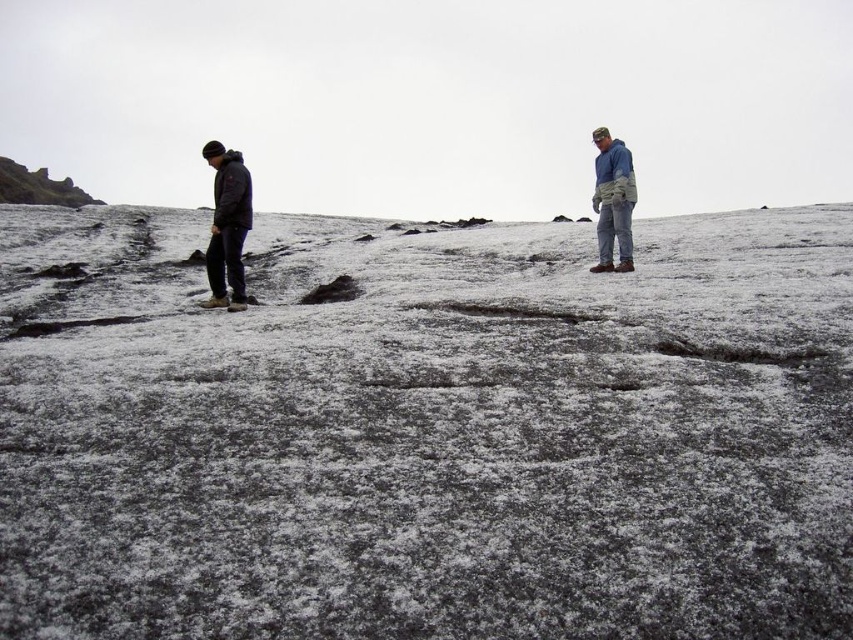
Question: Which point appears closest to the camera in this image?

Choices:
 (A) (79, 195)
 (B) (619, 195)
 (C) (517, 256)
 (D) (223, 147)

Answer: (D)

Question: Is blue fleece jacket at right to the left of rugged stone cliff at upper left from the viewer's perspective?

Choices:
 (A) no
 (B) yes

Answer: (A)

Question: Does white textured snow at center lie in front of matte black jacket at left?

Choices:
 (A) yes
 (B) no

Answer: (A)

Question: Which point appears closest to the camera in this image?

Choices:
 (A) (592, 296)
 (B) (6, 170)

Answer: (A)

Question: Which is nearer to the blue fleece jacket at right?

Choices:
 (A) rugged stone cliff at upper left
 (B) white textured snow at center
 (C) matte black jacket at left

Answer: (C)

Question: From the image, what is the correct spatial relationship of matte black jacket at left in relation to rugged stone cliff at upper left?

Choices:
 (A) left
 (B) right

Answer: (B)